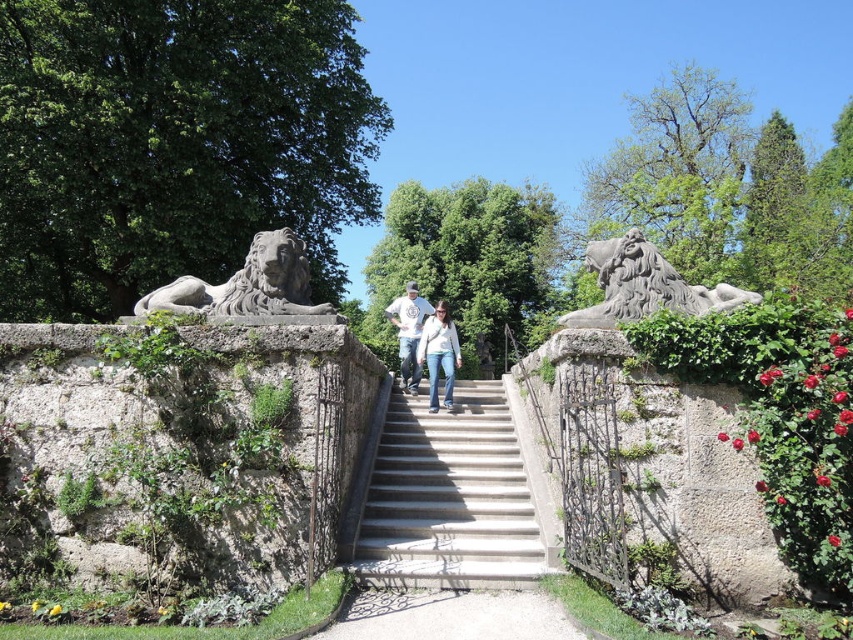
Question: Can you confirm if concrete stairs at center is bigger than denim jeans at center?

Choices:
 (A) no
 (B) yes

Answer: (A)

Question: Can you confirm if gray stone lion at upper right is thinner than white cotton shirt at center?

Choices:
 (A) yes
 (B) no

Answer: (B)

Question: Which of the following is the closest to the observer?

Choices:
 (A) (437, 308)
 (B) (433, 310)
 (C) (479, 436)
 (D) (177, 280)

Answer: (D)

Question: Which point is closer to the camera?

Choices:
 (A) concrete stairs at center
 (B) denim jeans at center
 (C) white cotton shirt at center
 (D) gray stone lion at left

Answer: (A)

Question: Which point is closer to the camera?

Choices:
 (A) (389, 433)
 (B) (434, 403)
 (C) (573, 321)

Answer: (C)

Question: Can you confirm if gray stone lion at left is positioned to the right of denim jeans at center?

Choices:
 (A) no
 (B) yes

Answer: (A)